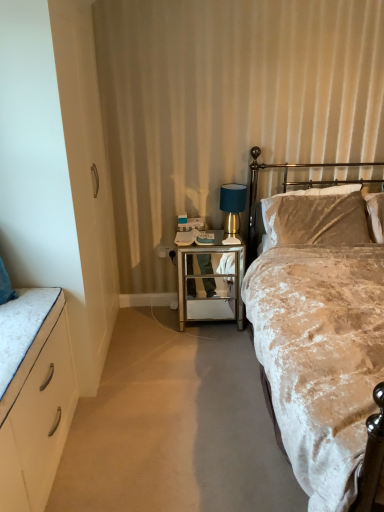
Question: Considering the relative sizes of black plastic power outlet at center and mirrored glass side table at center in the image provided, is black plastic power outlet at center shorter than mirrored glass side table at center?

Choices:
 (A) no
 (B) yes

Answer: (B)

Question: Does black plastic power outlet at center have a greater width compared to mirrored glass side table at center?

Choices:
 (A) yes
 (B) no

Answer: (B)

Question: From a real-world perspective, is black plastic power outlet at center located beneath mirrored glass side table at center?

Choices:
 (A) no
 (B) yes

Answer: (A)

Question: Is the position of black plastic power outlet at center more distant than that of mirrored glass side table at center?

Choices:
 (A) yes
 (B) no

Answer: (A)

Question: Is black plastic power outlet at center located outside mirrored glass side table at center?

Choices:
 (A) yes
 (B) no

Answer: (A)

Question: Considering the positions of teal fabric lampshade at right and white matte cabinet at left in the image, is teal fabric lampshade at right wider or thinner than white matte cabinet at left?

Choices:
 (A) thin
 (B) wide

Answer: (A)

Question: Which is correct: teal fabric lampshade at right is inside white matte cabinet at left, or outside of it?

Choices:
 (A) outside
 (B) inside

Answer: (A)

Question: From the image's perspective, is teal fabric lampshade at right above or below white matte cabinet at left?

Choices:
 (A) below
 (B) above

Answer: (B)

Question: Is point (221, 201) positioned closer to the camera than point (6, 408)?

Choices:
 (A) farther
 (B) closer

Answer: (A)

Question: From the image's perspective, is gold metallic headboard at upper right positioned above or below black plastic power outlet at center?

Choices:
 (A) above
 (B) below

Answer: (A)

Question: Would you say gold metallic headboard at upper right is to the left or to the right of black plastic power outlet at center in the picture?

Choices:
 (A) right
 (B) left

Answer: (A)

Question: Is point (254, 201) closer or farther from the camera than point (172, 249)?

Choices:
 (A) farther
 (B) closer

Answer: (A)

Question: Choose the correct answer: Is gold metallic headboard at upper right inside black plastic power outlet at center or outside it?

Choices:
 (A) inside
 (B) outside

Answer: (B)

Question: In terms of width, does teal fabric lampshade at right look wider or thinner when compared to velvet beige bed at right?

Choices:
 (A) wide
 (B) thin

Answer: (B)

Question: Is teal fabric lampshade at right bigger or smaller than velvet beige bed at right?

Choices:
 (A) big
 (B) small

Answer: (B)